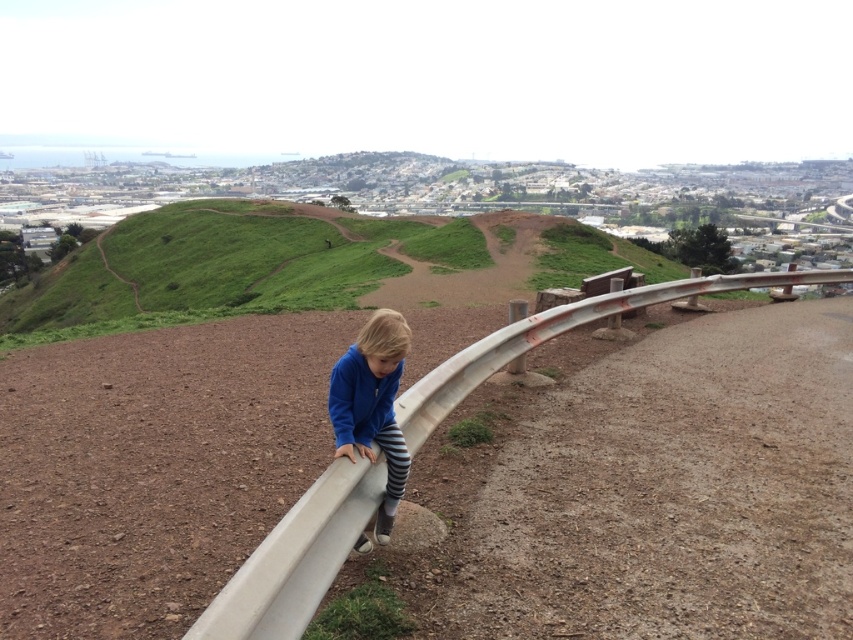
Measure the distance from white matte rail at center to blue fleece jacket at center.

white matte rail at center is 3.79 meters away from blue fleece jacket at center.

Between white matte rail at center and blue fleece jacket at center, which one has less height?

Standing shorter between the two is blue fleece jacket at center.

Does point (354, 472) come farther from viewer compared to point (387, 424)?

No, (354, 472) is closer to viewer.

Find the location of a particular element. The height and width of the screenshot is (640, 853). white matte rail at center is located at coordinates (556, 333).